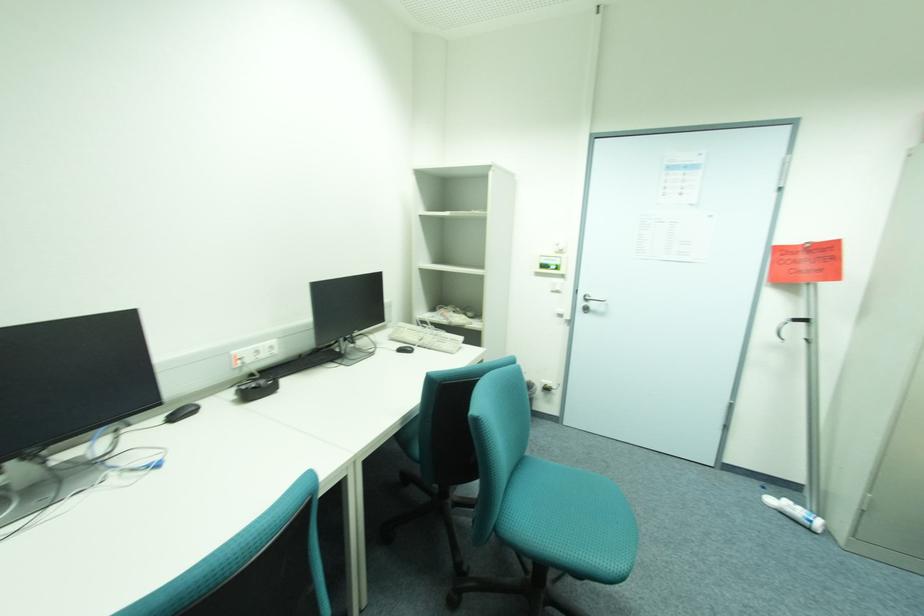
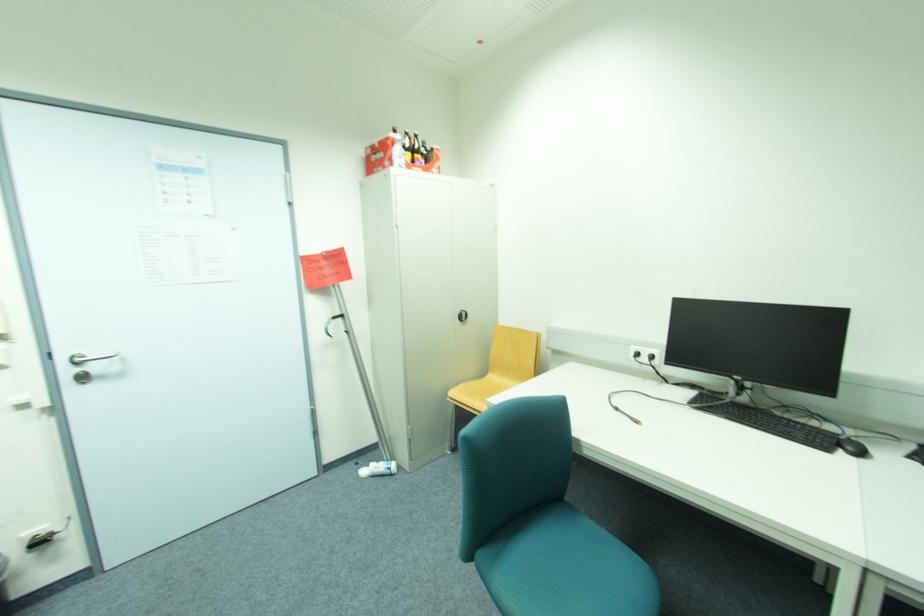
Question: The first image is from the beginning of the video and the second image is from the end. How did the camera likely rotate when shooting the video?

Choices:
 (A) Left
 (B) Right
 (C) Up
 (D) Down

Answer: (B)